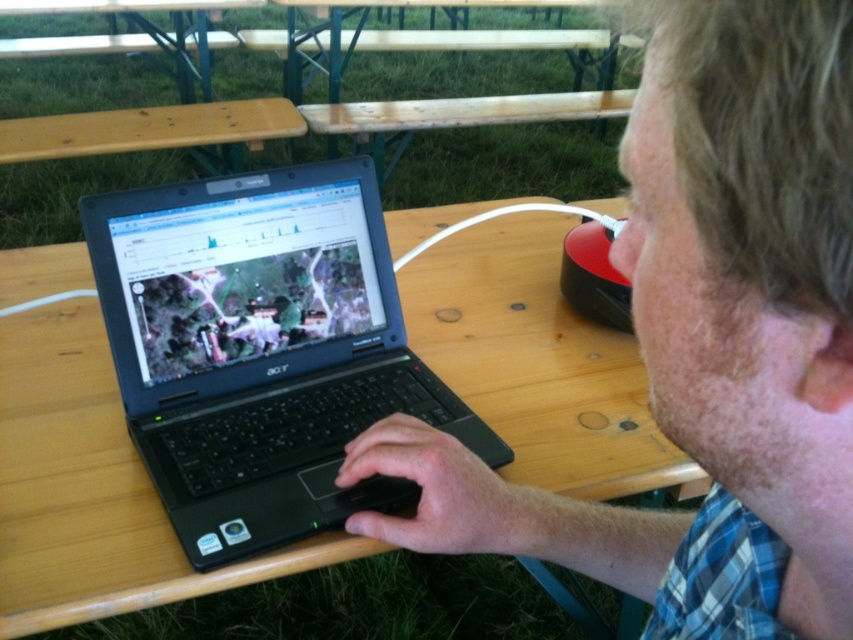
Question: Does plaid shirt at center have a smaller size compared to black matte laptop at center?

Choices:
 (A) yes
 (B) no

Answer: (A)

Question: Can you confirm if plaid shirt at center is bigger than black matte laptop at center?

Choices:
 (A) yes
 (B) no

Answer: (B)

Question: Which of the following is the farthest from the observer?

Choices:
 (A) plaid shirt at center
 (B) black matte laptop at center

Answer: (B)

Question: Which object is closer to the camera taking this photo?

Choices:
 (A) black matte laptop at center
 (B) plaid shirt at center

Answer: (B)

Question: Which point is farther from the camera taking this photo?

Choices:
 (A) (790, 506)
 (B) (349, 358)

Answer: (B)

Question: Does plaid shirt at center appear under black matte laptop at center?

Choices:
 (A) yes
 (B) no

Answer: (A)